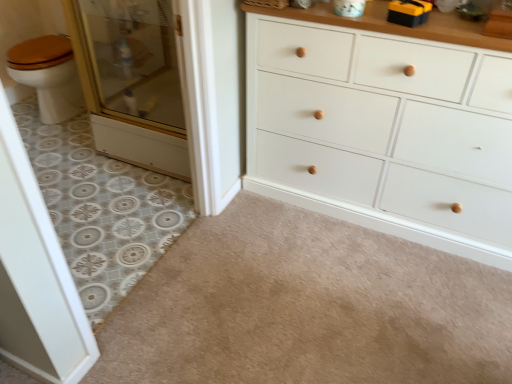
Locate an element on the screen. vacant space to the right of black plastic tool at upper right is located at coordinates (453, 28).